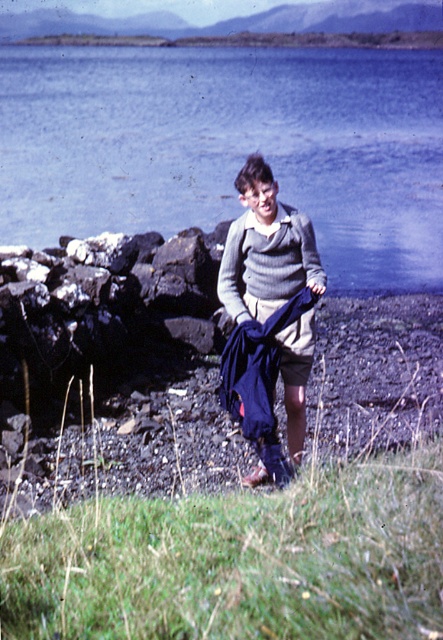
You are standing at point (253, 225) and want to walk to point (88, 221). Which direction should you walk relative to your current position?

You should walk forward because point (88, 221) is behind point (253, 225), meaning it is in the direction you are facing.

You are standing at the camera position and want to pick up the knitted sweater at center. Is the sweater within your immediate reach?

The knitted sweater at center is 5.96 meters from camera, so it is too far to reach immediately. You would need to move closer.